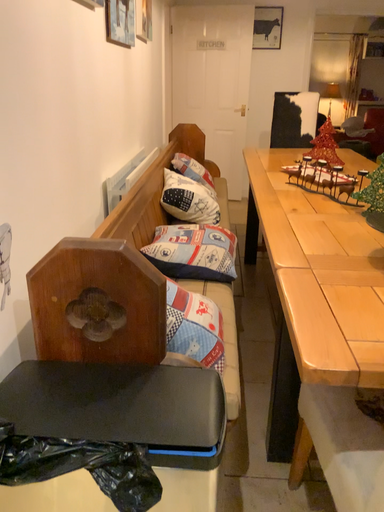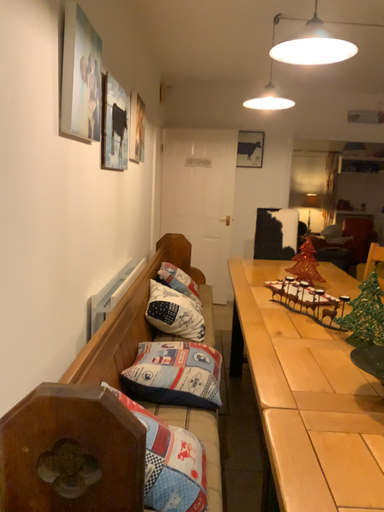
Question: Which way did the camera rotate in the video?

Choices:
 (A) rotated upward
 (B) rotated downward

Answer: (A)